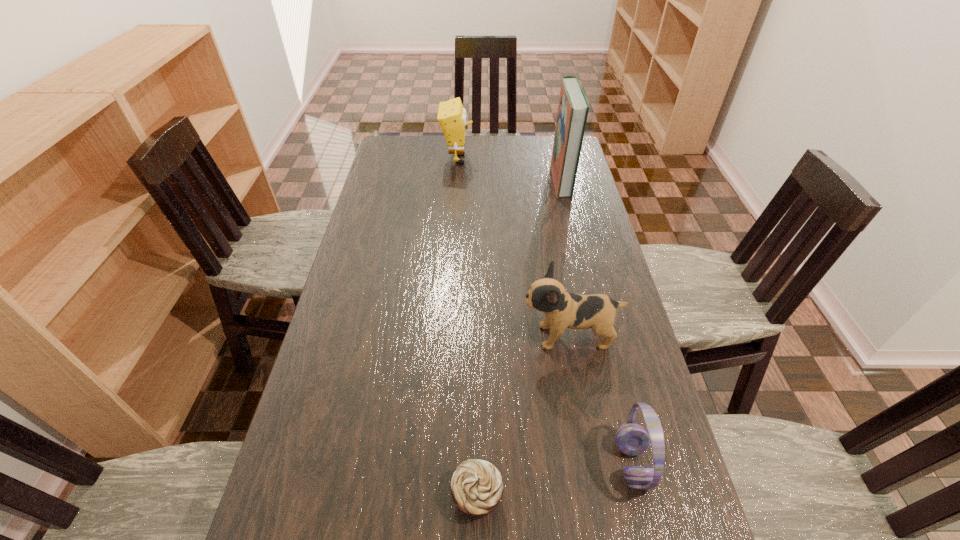
You are a GUI agent. You are given a task and a screenshot of the screen. Output one action in this format:
    pyautogui.click(x=<x>, y=<y>)
    Task: Click on the tallest object
    
    Given the screenshot: What is the action you would take?
    pyautogui.click(x=573, y=107)

The height and width of the screenshot is (540, 960). I want to click on sponge, so click(x=452, y=117).

Find the location of `the third farthest object`. the third farthest object is located at coordinates (563, 310).

Identify the location of the second shortest object. The width and height of the screenshot is (960, 540). (632, 439).

Where is `muffin`? muffin is located at coordinates (476, 486).

The image size is (960, 540). I want to click on vacant space positioned on the cover of the hardback book, so click(x=477, y=180).

This screenshot has height=540, width=960. Identify the location of free space located on the cover of the hardback book. (514, 180).

Find the location of `free space located 0.050m on the cover of the hardback book`. free space located 0.050m on the cover of the hardback book is located at coordinates (540, 180).

Identify the location of free space located 0.280m on the face of the sponge. (540, 159).

I want to click on free space located 0.050m at the face of the puppy, so click(502, 336).